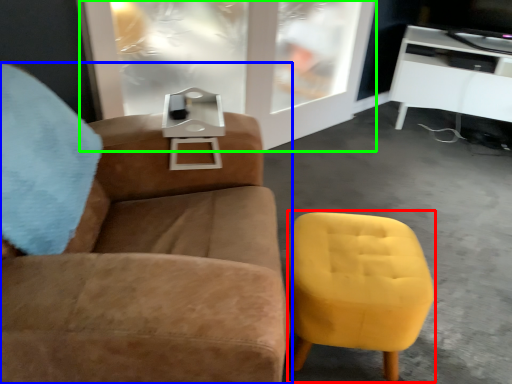
Question: Considering the real-world distances, which object is farthest from swivel chair (highlighted by a red box)? chair (highlighted by a blue box) or glass door (highlighted by a green box)?

Choices:
 (A) chair
 (B) glass door

Answer: (B)